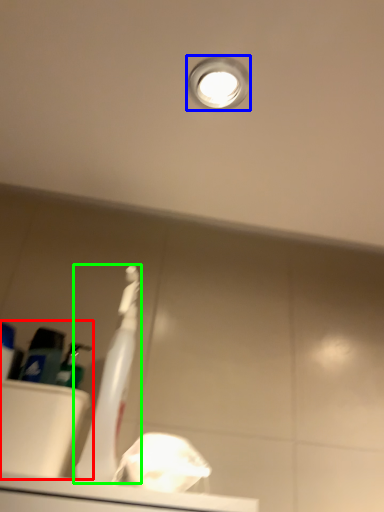
Question: Estimate the real-world distances between objects in this image. Which object is farther from sink (highlighted by a red box), droplight (highlighted by a blue box) or toothbrush (highlighted by a green box)?

Choices:
 (A) droplight
 (B) toothbrush

Answer: (A)